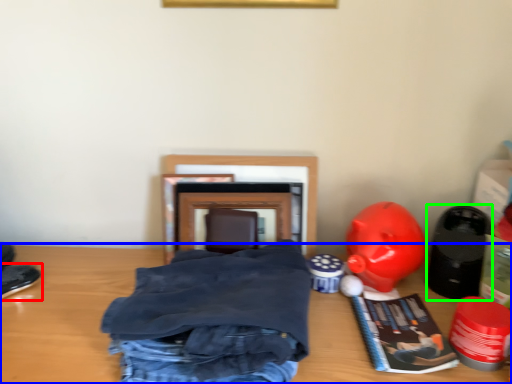
Question: Which object is positioned closest to footwear (highlighted by a red box)? Select from table (highlighted by a blue box) and toy (highlighted by a green box).

Choices:
 (A) table
 (B) toy

Answer: (A)